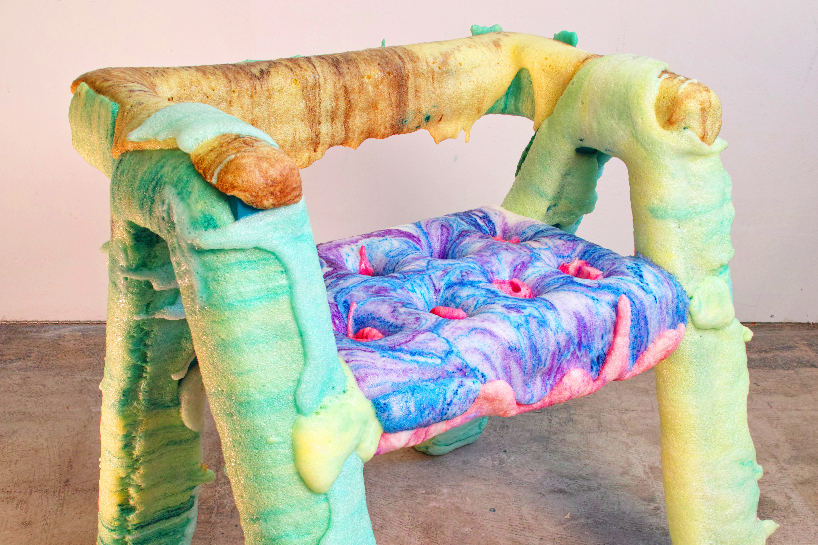
At what (x,y) coordinates should I click in order to perform the action: click on cushion. Please return your answer as a coordinate pair (x, y). Looking at the image, I should click on (486, 314).